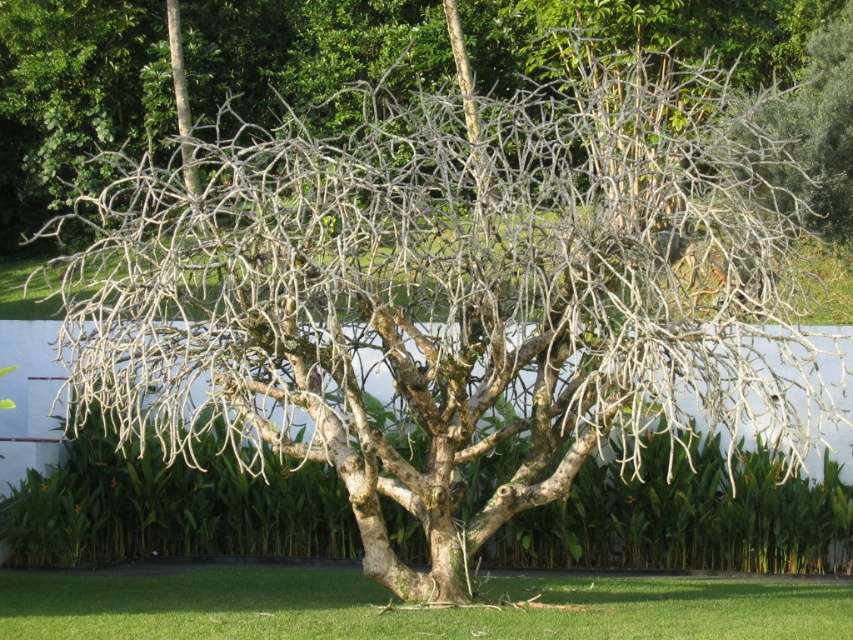
You are a gardener assessing the health of the bare branches at center and the green grass at lower center. Which one is taller?

The bare branches at center is taller than green grass at lower center.

You are standing in a garden and see the bare branches at center. If you move 0.05 units to the right along the x and y axes, will you be closer to the branches?

The bare branches at center are located at point (73, 97). Moving 0.05 units to the right along both the x and y axes would take you to (115, 129). Since the branches are at (73, 97), you would be moving away from them diagonally, so you would not be closer.